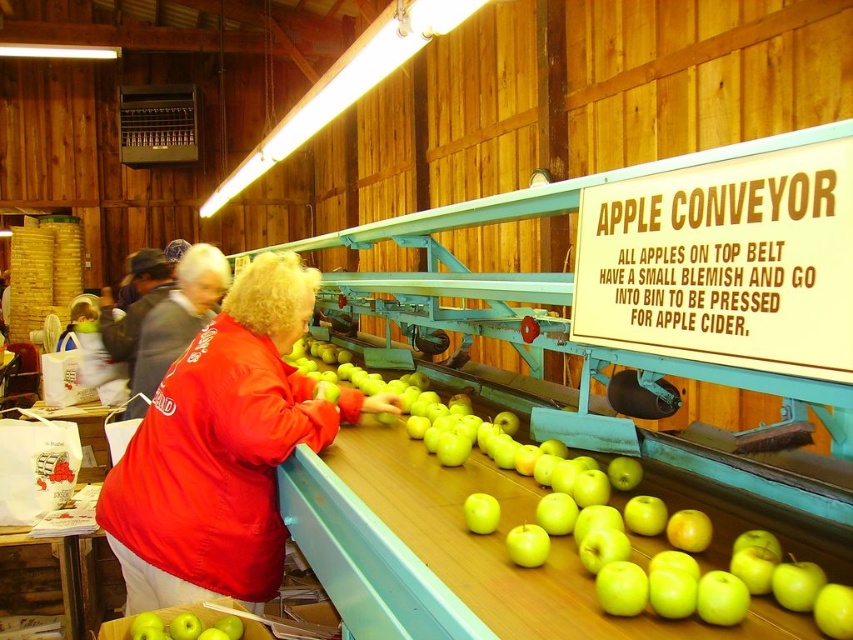
Who is shorter, red fabric jacket at center or green matte apple at lower left?

Standing shorter between the two is green matte apple at lower left.

Who is higher up, red fabric jacket at center or green matte apple at lower left?

red fabric jacket at center

Who is more distant from viewer, [157,600] or [192,628]?

Point [157,600]

Locate an element on the screen. Image resolution: width=853 pixels, height=640 pixels. red fabric jacket at center is located at coordinates (223, 449).

Is green shiny apple at center positioned behind green matte apple at lower left?

No, it is not.

Locate an element on the screen. green shiny apple at center is located at coordinates (527, 538).

Find the location of a particular element. green shiny apple at center is located at coordinates (x=527, y=538).

Based on the photo, which is below, green shiny apple at center or red fabric jacket at center?

Positioned lower is red fabric jacket at center.

The image size is (853, 640). What are the coordinates of `green shiny apple at center` in the screenshot? It's located at (527, 538).

I want to click on green shiny apple at center, so click(x=527, y=538).